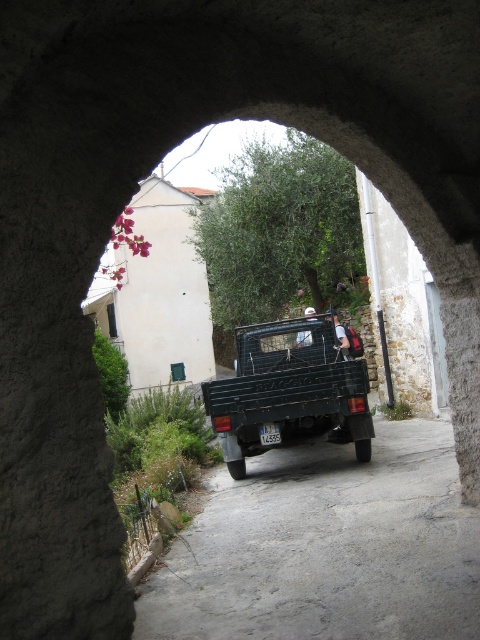
Is dark gray asphalt road at center to the right of green matte truck at center from the viewer's perspective?

No, dark gray asphalt road at center is not to the right of green matte truck at center.

Which is below, dark gray asphalt road at center or green matte truck at center?

dark gray asphalt road at center is below.

The image size is (480, 640). What do you see at coordinates (325, 547) in the screenshot?
I see `dark gray asphalt road at center` at bounding box center [325, 547].

Locate an element on the screen. The height and width of the screenshot is (640, 480). dark gray asphalt road at center is located at coordinates (325, 547).